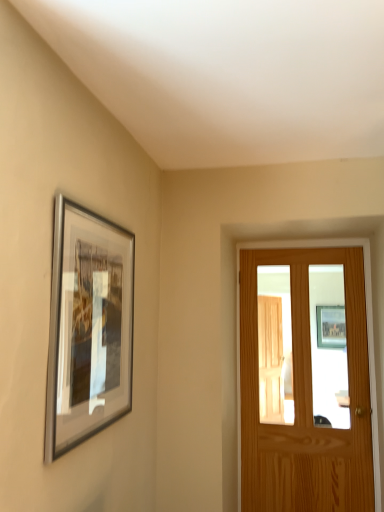
Question: Considering the positions of light brown wooden door at right and silver metallic picture frame at upper left in the image, is light brown wooden door at right wider or thinner than silver metallic picture frame at upper left?

Choices:
 (A) thin
 (B) wide

Answer: (B)

Question: Is light brown wooden door at right in front of or behind silver metallic picture frame at upper left in the image?

Choices:
 (A) behind
 (B) front

Answer: (A)

Question: Is light brown wooden door at right taller or shorter than silver metallic picture frame at upper left?

Choices:
 (A) tall
 (B) short

Answer: (A)

Question: In terms of height, does silver metallic picture frame at upper left look taller or shorter compared to light brown wooden door at right?

Choices:
 (A) short
 (B) tall

Answer: (A)

Question: Which is correct: silver metallic picture frame at upper left is inside light brown wooden door at right, or outside of it?

Choices:
 (A) outside
 (B) inside

Answer: (A)

Question: From a real-world perspective, is silver metallic picture frame at upper left physically located above or below light brown wooden door at right?

Choices:
 (A) below
 (B) above

Answer: (B)

Question: In the image, is silver metallic picture frame at upper left positioned in front of or behind light brown wooden door at right?

Choices:
 (A) behind
 (B) front

Answer: (B)